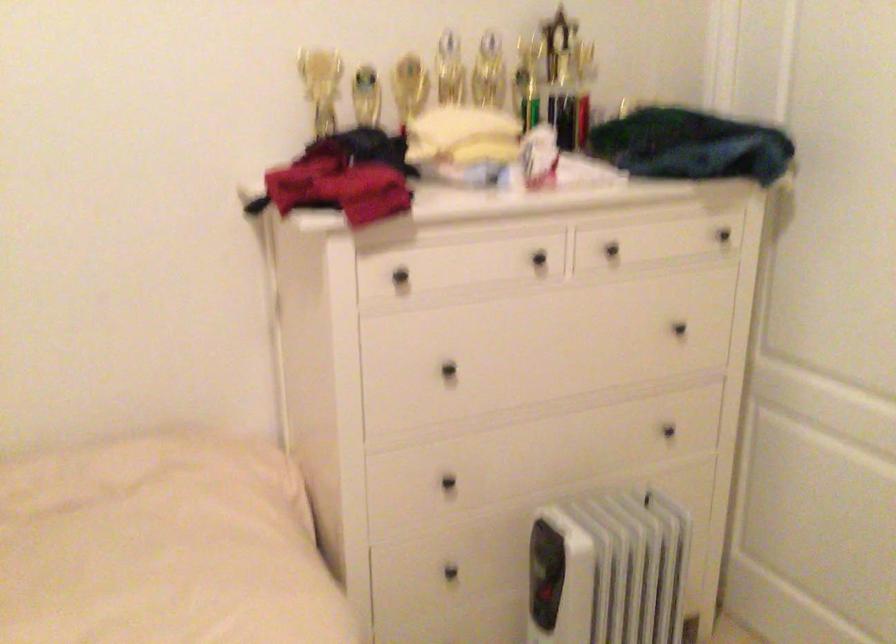
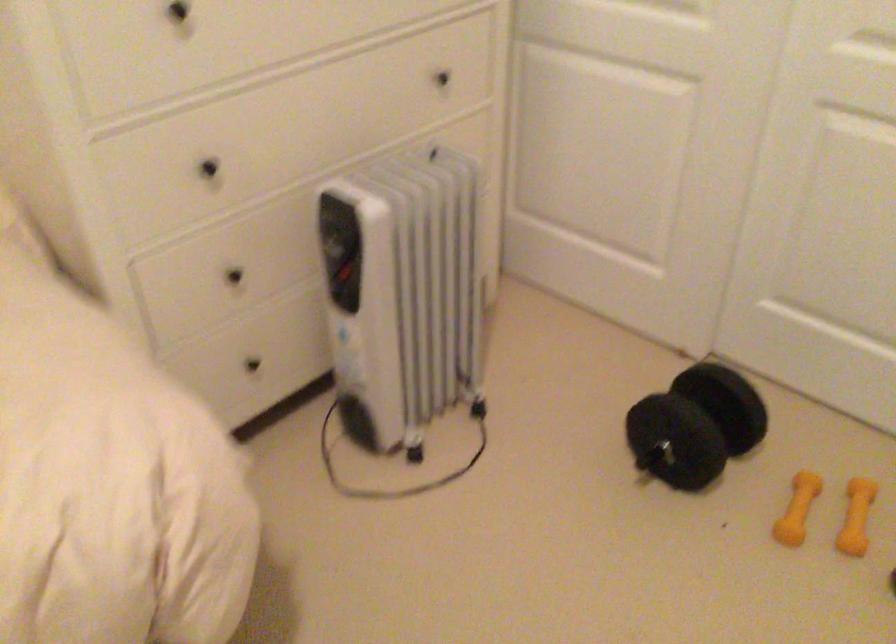
The first image is from the beginning of the video and the second image is from the end. How did the camera likely rotate when shooting the video?

The camera rotated toward right-down.